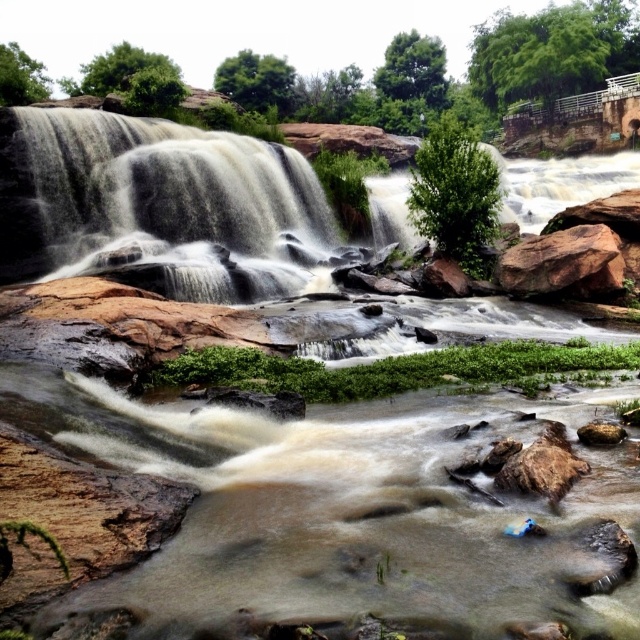
Is grayish-white water at upper left smaller than brown rough rock at lower right?

No.

Is point (320, 208) more distant than point (586, 440)?

Yes, it is behind point (586, 440).

Find the location of a particular element. The width and height of the screenshot is (640, 640). grayish-white water at upper left is located at coordinates (157, 202).

Is grayish-white water at upper left in front of brown rough rock at right?

No.

Who is more distant from viewer, (136, 184) or (616, 273)?

Point (136, 184)

What are the coordinates of `grayish-white water at upper left` in the screenshot? It's located at (157, 202).

Is brown rough rock at right behind brown rough rock at lower right?

That is True.

Does brown rough rock at right appear under brown rough rock at lower right?

No, brown rough rock at right is not below brown rough rock at lower right.

Which is behind, point (595, 244) or point (588, 429)?

The point (595, 244) is behind.

This screenshot has width=640, height=640. I want to click on brown rough rock at right, so click(563, 262).